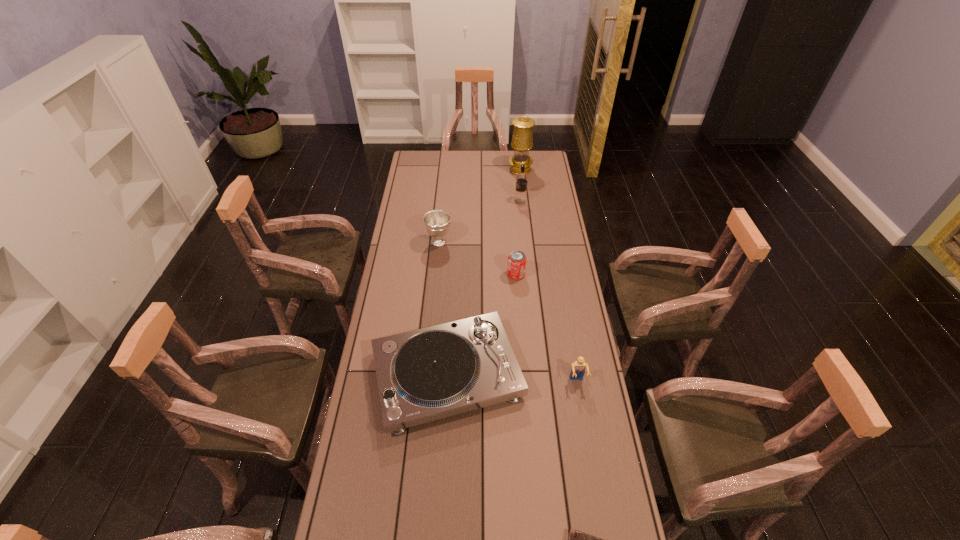
You are a GUI agent. You are given a task and a screenshot of the screen. Output one action in this format:
    pyautogui.click(x=<x>, y=<y>)
    Task: Click on the vacant point located 0.330m on the label of the vodka
    This screenshot has height=540, width=960.
    Given the screenshot: What is the action you would take?
    pyautogui.click(x=450, y=201)

Where is `free location located 0.130m on the label of the vodka`? The image size is (960, 540). free location located 0.130m on the label of the vodka is located at coordinates (489, 201).

Find the location of `vacant point located 0.280m on the label of the vodka`. vacant point located 0.280m on the label of the vodka is located at coordinates (460, 201).

This screenshot has width=960, height=540. In order to click on free region located 0.120m on the left of the chalice in this screenshot , I will do `click(400, 242)`.

Where is `vacant space located on the face of the Lego`? Image resolution: width=960 pixels, height=540 pixels. vacant space located on the face of the Lego is located at coordinates click(x=593, y=478).

You are a GUI agent. You are given a task and a screenshot of the screen. Output one action in this format:
    pyautogui.click(x=<x>, y=<y>)
    Task: Click on the vacant space located on the back of the record player
    
    Given the screenshot: What is the action you would take?
    pyautogui.click(x=451, y=305)

Locate an element on the screen. free space located 0.370m on the front of the can is located at coordinates (522, 353).

Where is `object at the far edge`? The height and width of the screenshot is (540, 960). object at the far edge is located at coordinates (522, 141).

Identify the location of chalice at the left edge. (437, 222).

Identify the location of record player that is at the left edge. The image size is (960, 540). [427, 374].